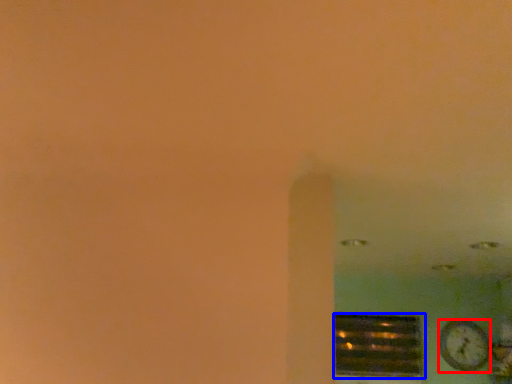
Question: Which object is closer to the camera taking this photo, clock (highlighted by a red box) or window (highlighted by a blue box)?

Choices:
 (A) clock
 (B) window

Answer: (A)